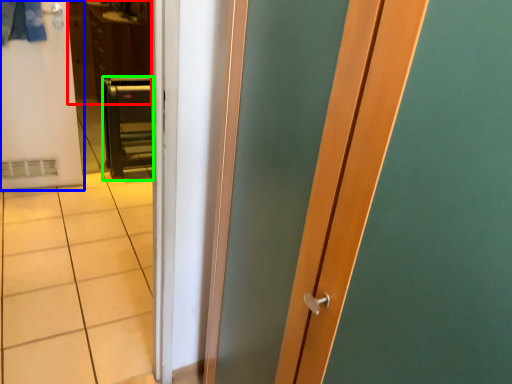
Question: Estimate the real-world distances between objects in this image. Which object is farther from dresser (highlighted by a red box), door (highlighted by a blue box) or furniture (highlighted by a green box)?

Choices:
 (A) door
 (B) furniture

Answer: (A)